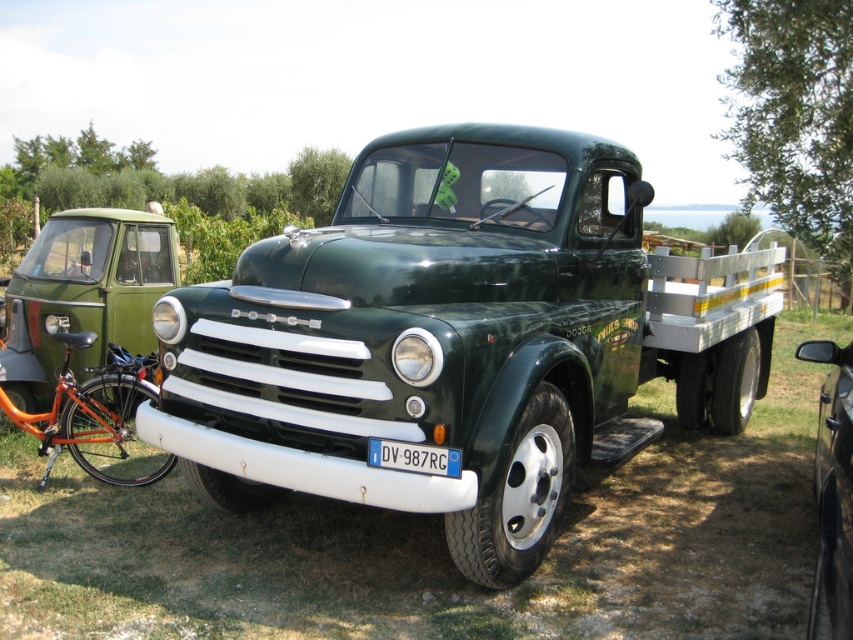
You are a delivery person needing to load a large package onto the truck. The package requires a truck bed that can accommodate its size. Which truck between the green metallic truck at center and the green matte truck at center should you choose?

The green matte truck at center should be chosen because it is larger than the green metallic truck at center, providing more space for the large package.

You are planning to park your car in a parking lot that has a width of 2.5 meters. You see the green metallic truck at center and the green matte van at left in the image. Can both vehicles fit side by side in the parking space?

The green metallic truck at center is bigger than the green matte van at left. Since the parking space is only 2.5 meters wide, and the truck is larger, it is unlikely both vehicles can fit side by side in the space.

You are standing in front of the green metallic truck at center and want to move to the green matte van at left. Which direction should you walk to reach the van?

You should walk to the left to reach the green matte van at left since the green metallic truck at center is positioned to the right of it.